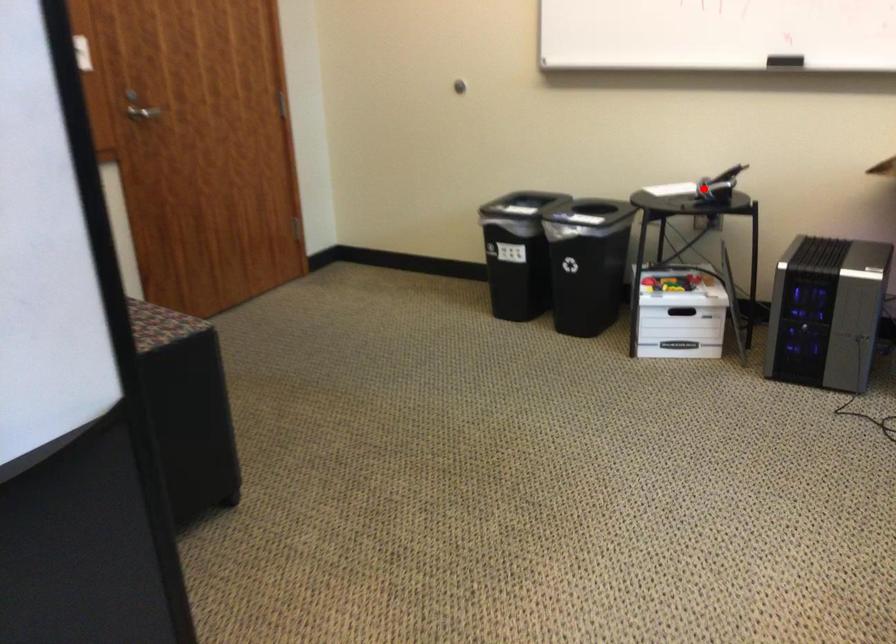
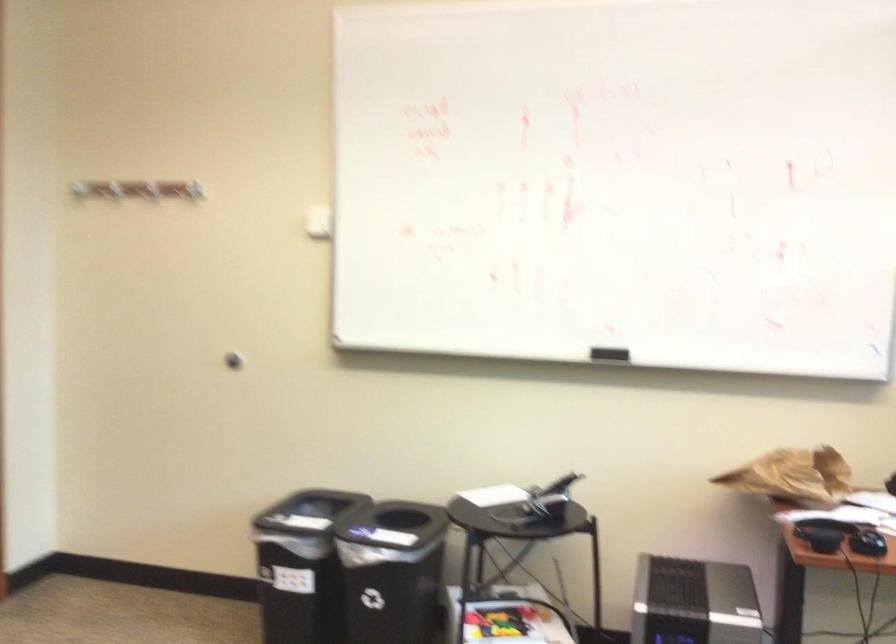
Locate, in the second image, the point that corresponds to the highlighted location in the first image.

(539, 503)